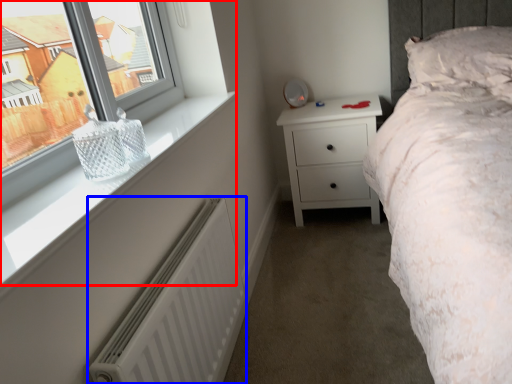
Question: Which point is closer to the camera, window (highlighted by a red box) or radiator (highlighted by a blue box)?

Choices:
 (A) window
 (B) radiator

Answer: (A)